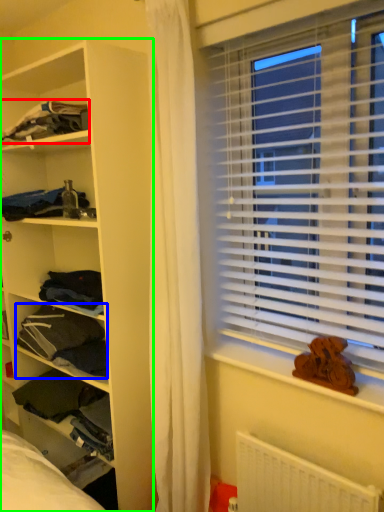
Question: Considering the real-world distances, which object is closest to clothing (highlighted by a red box)? clothing (highlighted by a blue box) or shelf (highlighted by a green box).

Choices:
 (A) clothing
 (B) shelf

Answer: (B)